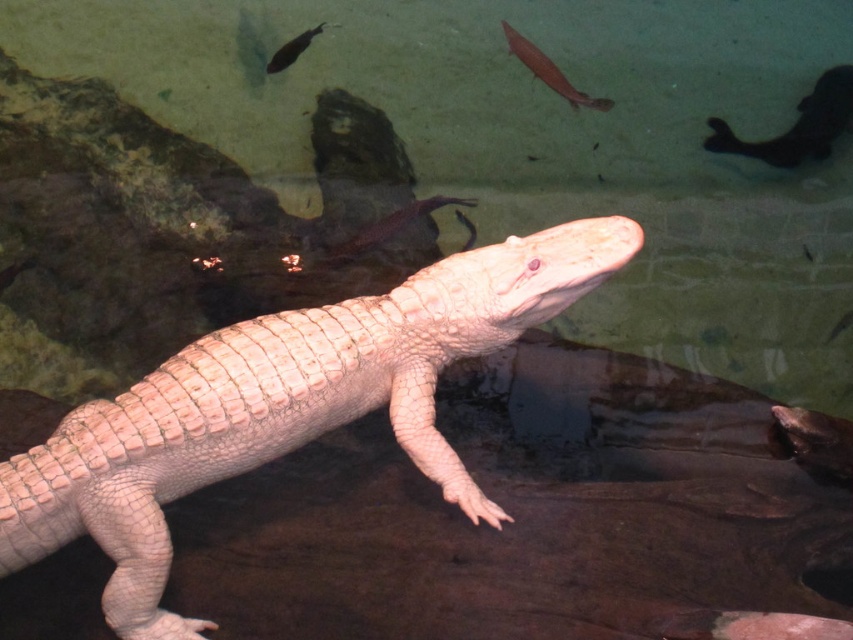
How much distance is there between silvery metallic fish at upper right and shiny silver fish at upper center?

18.58 inches

Who is positioned more to the right, silvery metallic fish at upper right or shiny silver fish at upper center?

silvery metallic fish at upper right

Who is more forward, (814, 88) or (534, 45)?

Point (534, 45) is in front.

Identify the location of silvery metallic fish at upper right. The height and width of the screenshot is (640, 853). (796, 124).

Is pale matte crocodile at center in front of shiny black fish at upper left?

Yes, pale matte crocodile at center is in front of shiny black fish at upper left.

Where is `pale matte crocodile at center`? The image size is (853, 640). pale matte crocodile at center is located at coordinates (285, 406).

Describe the element at coordinates (285, 406) in the screenshot. The image size is (853, 640). I see `pale matte crocodile at center` at that location.

This screenshot has width=853, height=640. I want to click on pale matte crocodile at center, so pyautogui.click(x=285, y=406).

Is point (730, 144) less distant than point (438, 196)?

No, (730, 144) is behind (438, 196).

Measure the distance between point [712,124] and camera.

Point [712,124] is 8.60 feet away from camera.

Locate an element on the screen. The image size is (853, 640). silvery metallic fish at upper right is located at coordinates (796, 124).

The height and width of the screenshot is (640, 853). I want to click on silvery metallic fish at upper right, so click(x=796, y=124).